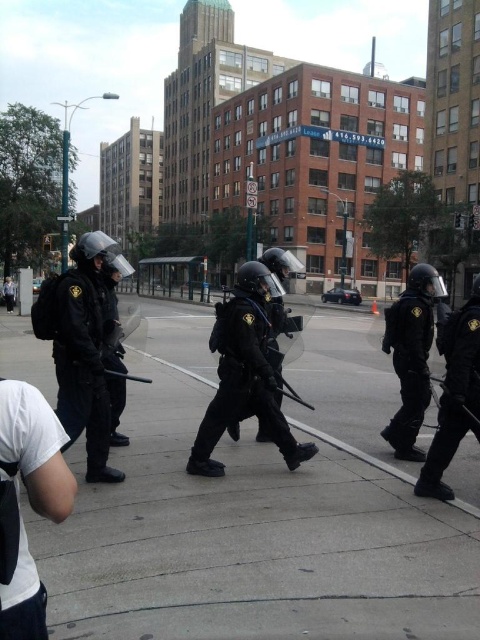
Question: Which object is the farthest from the matte black helmet at left?

Choices:
 (A) black matte helmet at right
 (B) matte black helmet at right

Answer: (A)

Question: Which point is farther from the camera taking this photo?

Choices:
 (A) (472, 376)
 (B) (43, 522)
 (C) (429, 292)

Answer: (C)

Question: Is concrete at center bigger than matte black helmet at right?

Choices:
 (A) no
 (B) yes

Answer: (B)

Question: Can you confirm if matte black helmet at center is thinner than matte black helmet at left?

Choices:
 (A) no
 (B) yes

Answer: (B)

Question: Among these points, which one is farthest from the camera?

Choices:
 (A) pos(471,401)
 (B) pos(395,355)
 (C) pos(96,410)

Answer: (B)

Question: Can you confirm if concrete at center is positioned to the right of black matte helmet at right?

Choices:
 (A) yes
 (B) no

Answer: (B)